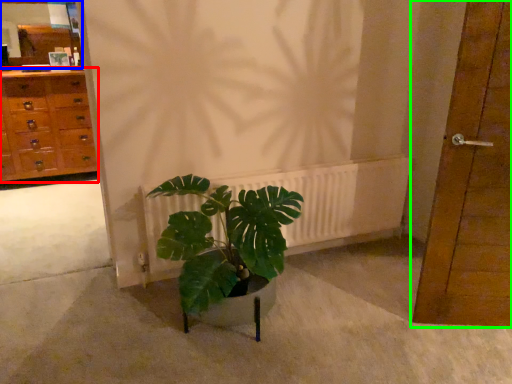
Question: Considering the real-world distances, which object is closest to chest of drawers (highlighted by a red box)? mirror (highlighted by a blue box) or door (highlighted by a green box).

Choices:
 (A) mirror
 (B) door

Answer: (A)